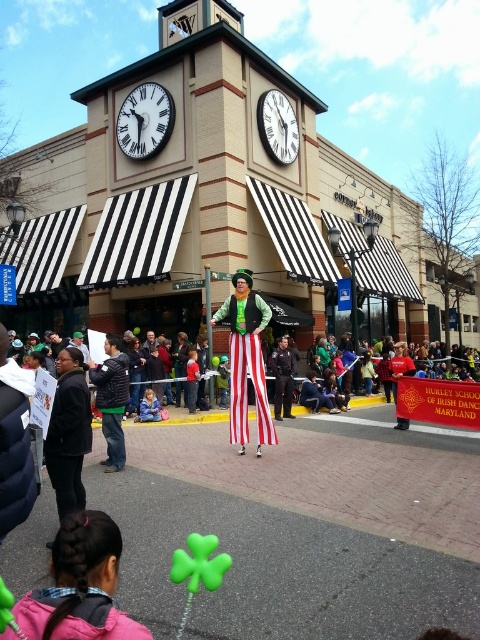
Who is more distant from viewer, (135, 112) or (283, 97)?

Positioned behind is point (283, 97).

Does white matte clock at upper center appear on the right side of white glossy clock at upper center?

In fact, white matte clock at upper center is to the left of white glossy clock at upper center.

Does point (140, 136) lie in front of point (269, 106)?

Yes, it is.

The width and height of the screenshot is (480, 640). Identify the location of white matte clock at upper center. (144, 120).

Is beige brick building at center above smooth black uniform at center?

Yes.

Image resolution: width=480 pixels, height=640 pixels. What do you see at coordinates (218, 205) in the screenshot? I see `beige brick building at center` at bounding box center [218, 205].

Which is behind, point (442, 307) or point (269, 364)?

The point (442, 307) is more distant.

The width and height of the screenshot is (480, 640). Identify the location of beige brick building at center. (218, 205).

Who is more forward, (104,536) or (269,148)?

Point (104,536) is in front.

This screenshot has width=480, height=640. Find the location of `pink fleece jacket at lower left`. pink fleece jacket at lower left is located at coordinates 80,586.